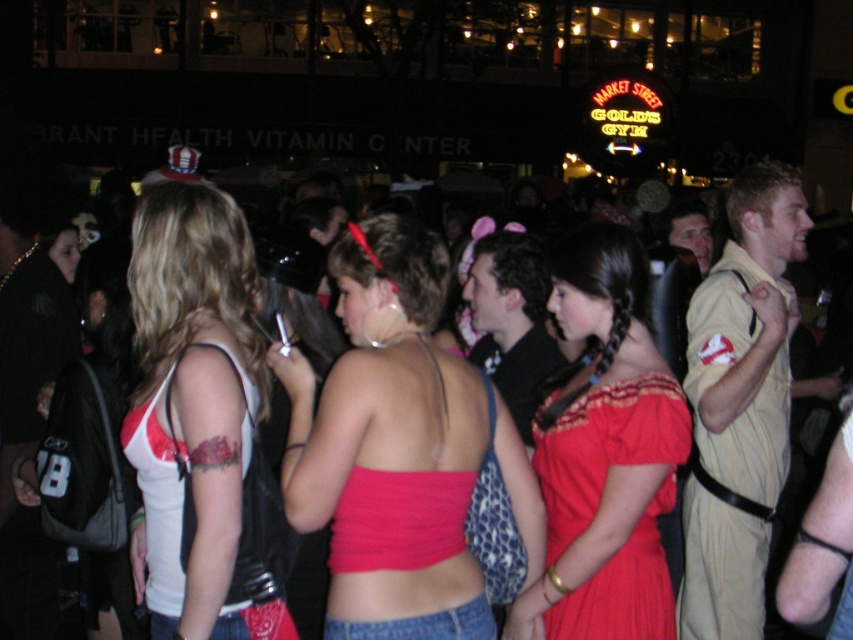
From the picture: Is matte pink fabric top at center to the left of tan uniform at right from the viewer's perspective?

Correct, you'll find matte pink fabric top at center to the left of tan uniform at right.

Is matte pink fabric top at center smaller than tan uniform at right?

Correct, matte pink fabric top at center occupies less space than tan uniform at right.

You are a GUI agent. You are given a task and a screenshot of the screen. Output one action in this format:
    pyautogui.click(x=<x>, y=<y>)
    Task: Click on the matte pink fabric top at center
    Image resolution: width=853 pixels, height=640 pixels.
    Given the screenshot: What is the action you would take?
    pyautogui.click(x=398, y=449)

Find the location of a particular element. Image resolution: width=853 pixels, height=640 pixels. matte pink fabric top at center is located at coordinates (398, 449).

Can you confirm if matte pink fabric top at center is taller than matte red dress at center?

Indeed, matte pink fabric top at center has a greater height compared to matte red dress at center.

Who is lower down, matte pink fabric top at center or matte red dress at center?

Positioned lower is matte red dress at center.

Measure the distance between matte pink fabric top at center and camera.

They are 3.71 meters apart.

You are a GUI agent. You are given a task and a screenshot of the screen. Output one action in this format:
    pyautogui.click(x=<x>, y=<y>)
    Task: Click on the matte pink fabric top at center
    The image size is (853, 640).
    Given the screenshot: What is the action you would take?
    pyautogui.click(x=398, y=449)

Can you confirm if white matte tank top at center is smaller than tan leather jacket at right?

No, white matte tank top at center is not smaller than tan leather jacket at right.

Is white matte tank top at center bigger than tan leather jacket at right?

Correct, white matte tank top at center is larger in size than tan leather jacket at right.

Is point (241, 266) farther from viewer compared to point (675, 227)?

No, it is in front of (675, 227).

Where is `white matte tank top at center`? The height and width of the screenshot is (640, 853). white matte tank top at center is located at coordinates (193, 408).